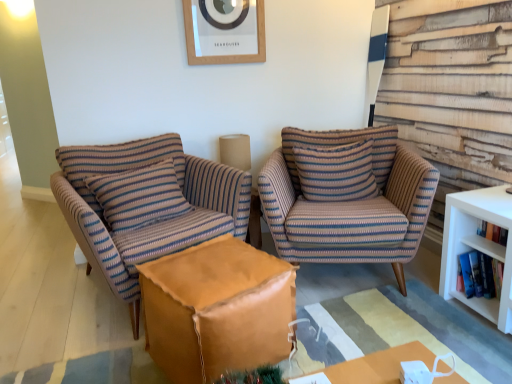
Identify the location of free location in front of striped fabric armchair at center, which is the second chair in left-to-right order. [x=400, y=326].